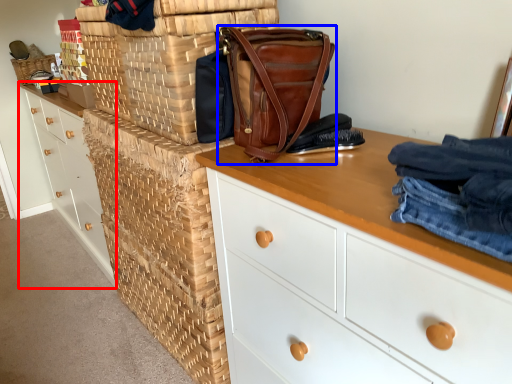
Question: Which object is further to the camera taking this photo, chest of drawers (highlighted by a red box) or handbag (highlighted by a blue box)?

Choices:
 (A) chest of drawers
 (B) handbag

Answer: (A)